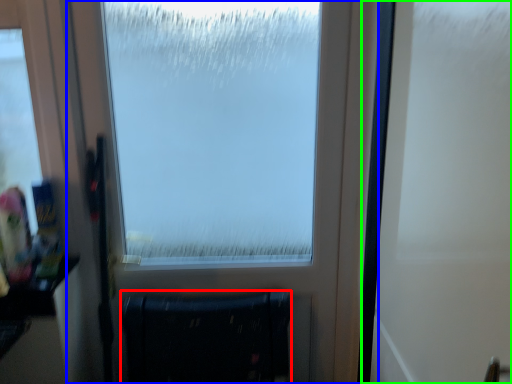
Question: Which object is positioned farthest from furniture (highlighted by a red box)? Select from window (highlighted by a blue box) and screen door (highlighted by a green box).

Choices:
 (A) window
 (B) screen door

Answer: (B)